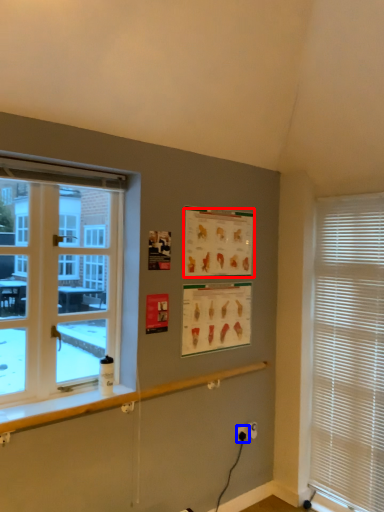
Question: Which of the following is the farthest to the observer, poster page (highlighted by a red box) or electric outlet (highlighted by a blue box)?

Choices:
 (A) poster page
 (B) electric outlet

Answer: (B)